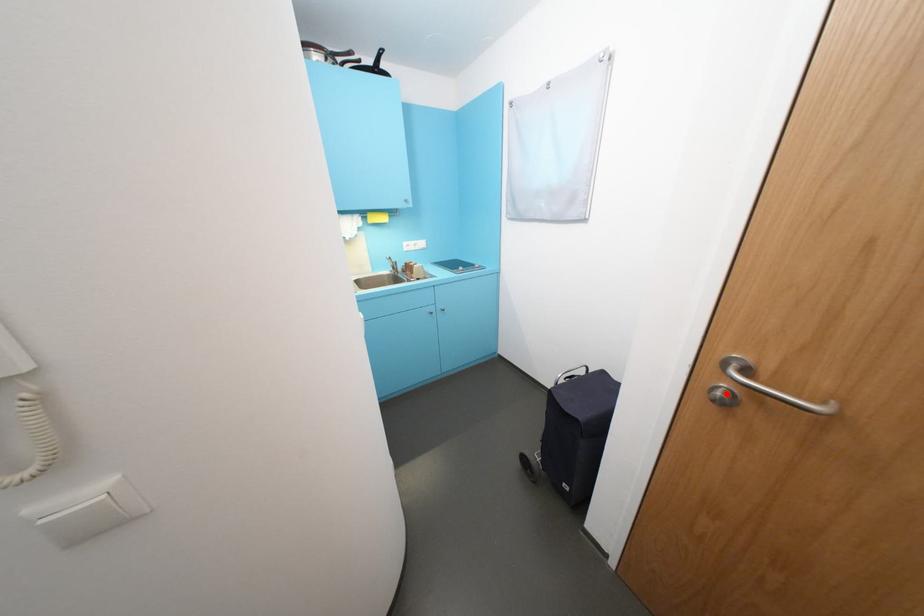
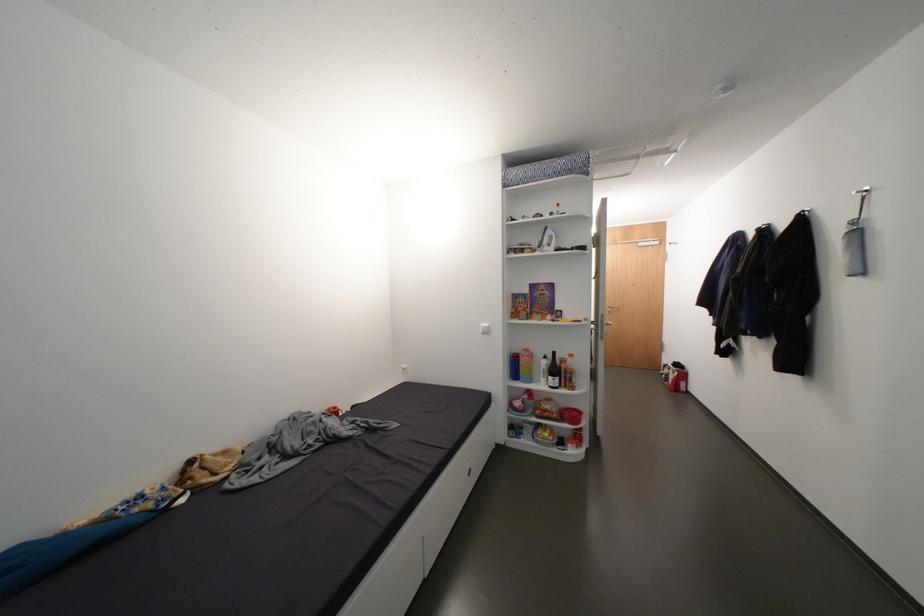
Question: I am providing you with two images of the same scene from different viewpoints. In image1, a red point is highlighted. Considering the same 3D point in image2, which of the following is correct?

Choices:
 (A) It is closer
 (B) It is farther

Answer: (B)